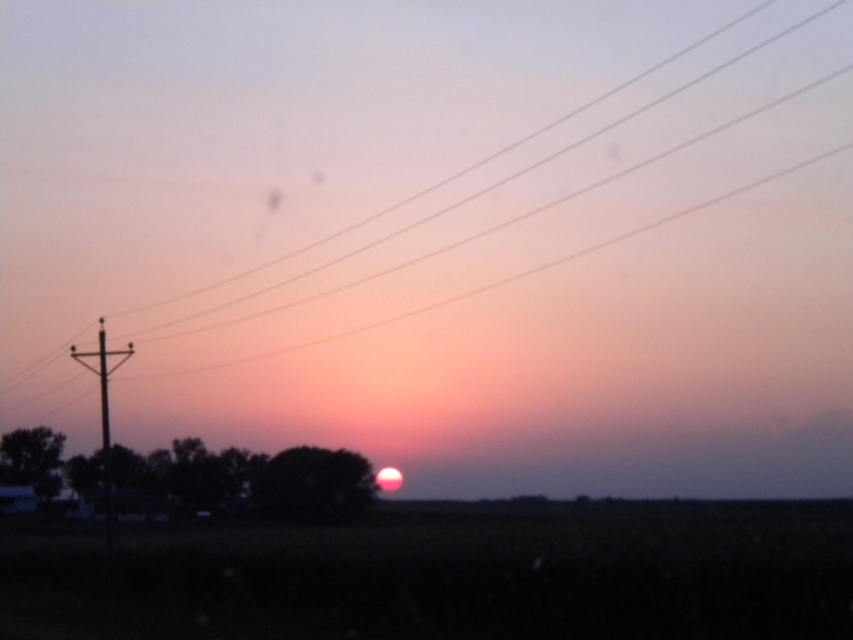
You are an artist trying to draw this sunset scene. You want to ensure the silhouette tree at center and the smooth wood telegraph pole at left are proportionally accurate. Which object should you draw taller?

The smooth wood telegraph pole at left should be drawn taller because the silhouette tree at center has a lesser height compared to it.

You are a painter setting up your easel in the middle of the field. You want to paint the green matte tree at lower center and the smooth wood telegraph pole at left. Which object should you focus on first if you want to paint the wider one?

The green matte tree at lower center might be wider than smooth wood telegraph pole at left, so you should focus on the green matte tree at lower center first.